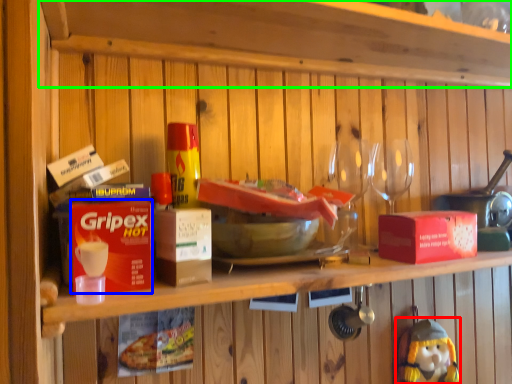
Question: Which object is the farthest from figurine (highlighted by a red box)? Choose among these: box (highlighted by a blue box) or shelf (highlighted by a green box).

Choices:
 (A) box
 (B) shelf

Answer: (A)